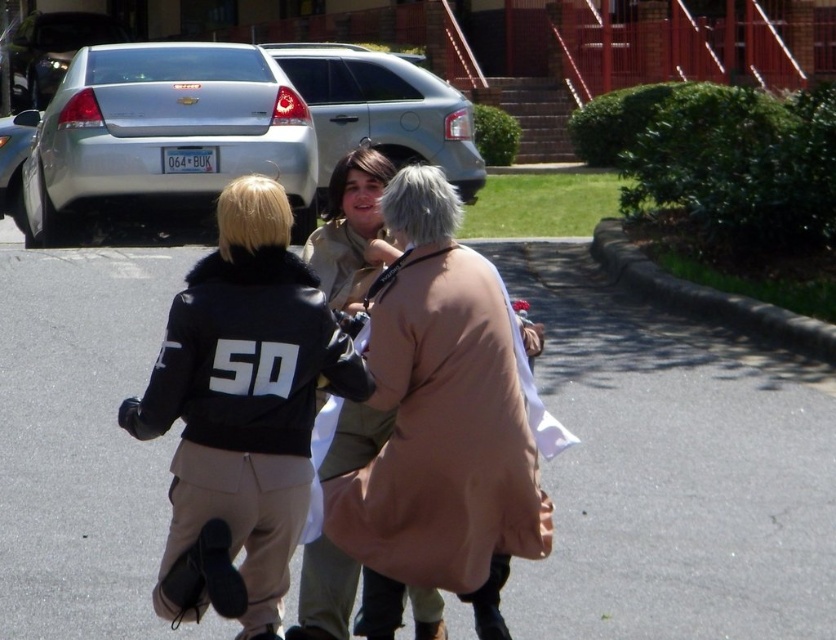
You are standing at the edge of the scene and want to take a photo of the black leather jacket at center without including the satin silver sedan at upper left in the frame. Is this possible based on their positions?

The black leather jacket at center is below the satin silver sedan at upper left, so if you position yourself to aim the camera downward towards the jacket while avoiding the upper left area, it should be possible to exclude the sedan from the frame.

You are standing in the scene and want to hide behind the black leather jacket at center and the satin silver sedan at upper left. Which object would provide better coverage for your height?

The satin silver sedan at upper left is taller than the black leather jacket at center, so it would provide better coverage for your height.